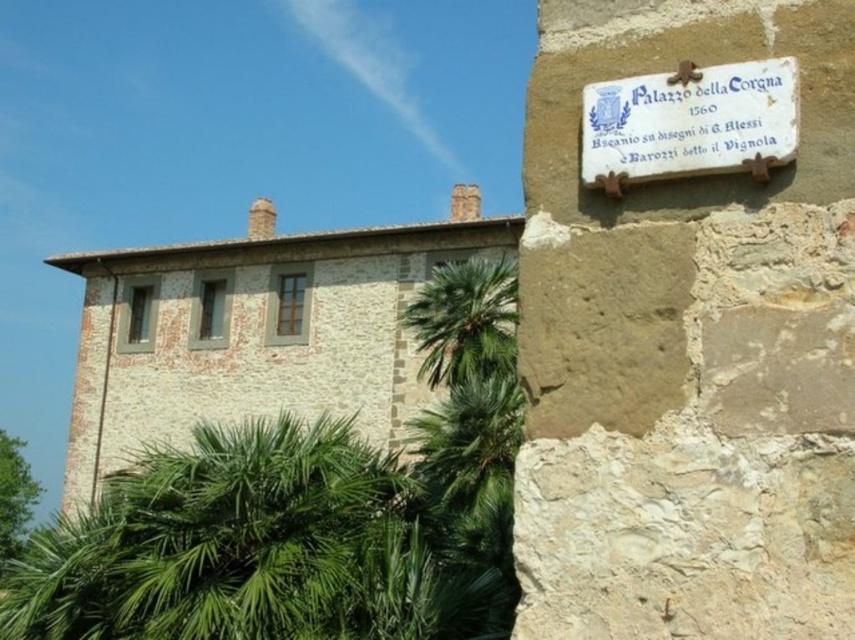
You are standing in front of the Palazzo della Corgna and notice the white stone plaque at upper right and the green leafy palm at center. Which object is positioned more to the right side of the image?

The white stone plaque at upper right is positioned more to the right side of the image than the green leafy palm at center.

You are a tour guide explaining the historical significance of the Palazzo della Corgna to visitors. You point out the white stone plaque at upper right and the green leafy palm at center. Which object is shorter in height?

The white stone plaque at upper right has a lesser height compared to the green leafy palm at center, so the white stone plaque at upper right is shorter in height.